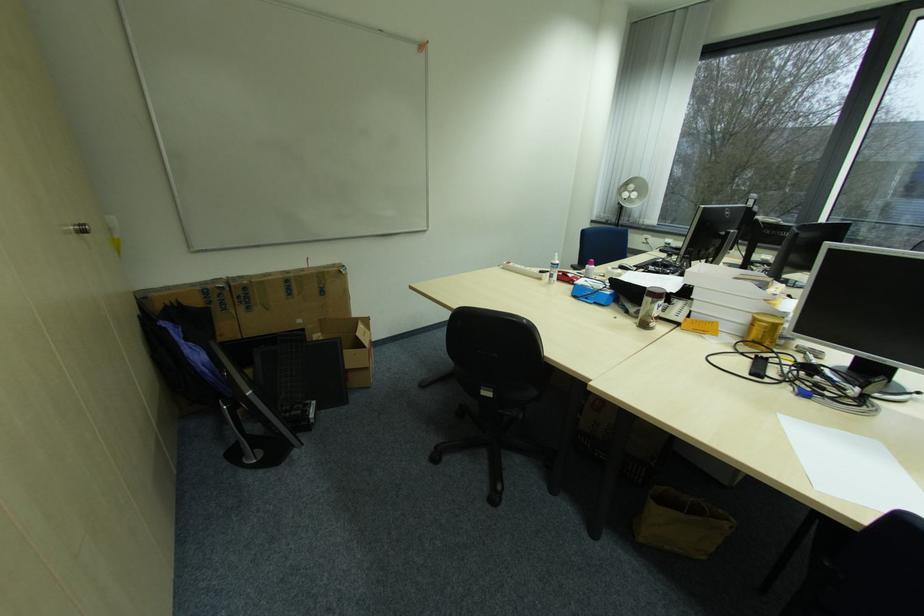
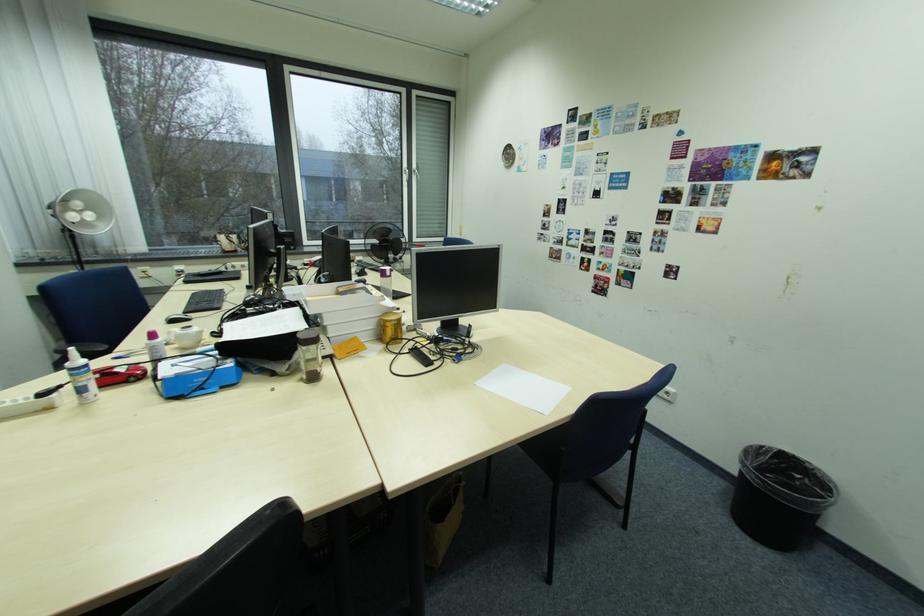
The point at (785, 415) is marked in the first image. Where is the corresponding point in the second image?

(482, 384)